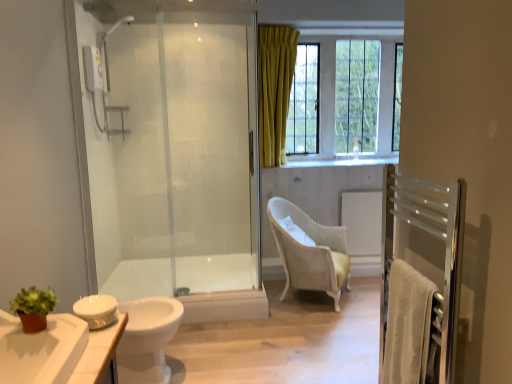
Question: From their relative heights in the image, would you say white glossy toilet at lower left is taller or shorter than matte glass window at upper right?

Choices:
 (A) short
 (B) tall

Answer: (A)

Question: Is white glossy toilet at lower left spatially inside matte glass window at upper right, or outside of it?

Choices:
 (A) outside
 (B) inside

Answer: (A)

Question: Which is farther from the white wicker chair at center?

Choices:
 (A) white glossy cabinet at lower left
 (B) matte glass window at upper right
 (C) white glossy faucet at upper center
 (D) white glossy toilet at lower left
 (E) transparent glass shower door at left

Answer: (A)

Question: Which of these objects is positioned farthest from the white glossy cabinet at lower left?

Choices:
 (A) white glossy faucet at upper center
 (B) white wicker chair at center
 (C) matte glass window at upper right
 (D) white glossy toilet at lower left
 (E) transparent glass shower door at left

Answer: (A)